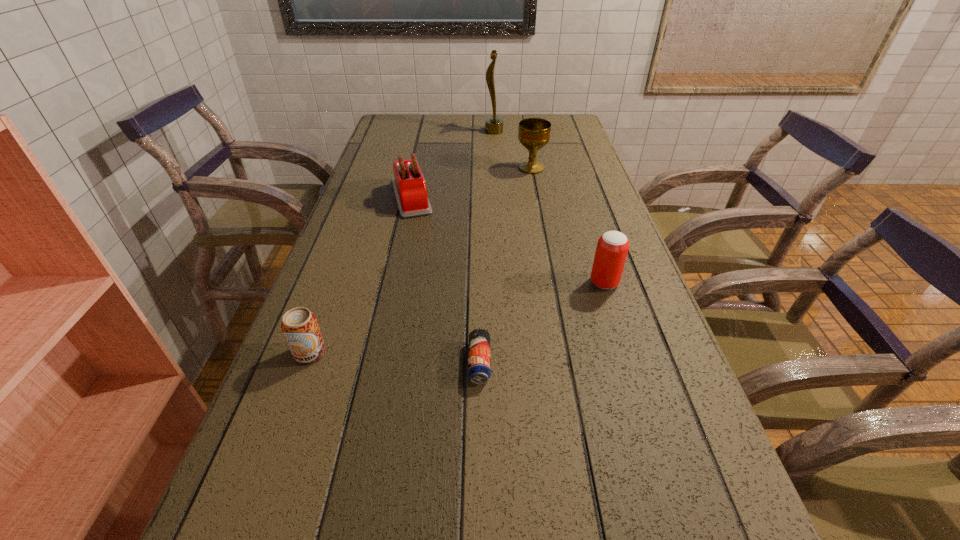
What are the coordinates of `object present at the far edge` in the screenshot? It's located at (494, 125).

I want to click on toaster positioned at the left edge, so click(x=409, y=185).

Identify the location of beer can that is at the left edge. The width and height of the screenshot is (960, 540). (300, 327).

You are a GUI agent. You are given a task and a screenshot of the screen. Output one action in this format:
    pyautogui.click(x=<x>, y=<y>)
    Task: Click on the object present at the right edge
    
    Given the screenshot: What is the action you would take?
    pyautogui.click(x=612, y=248)

This screenshot has height=540, width=960. I want to click on vacant position at the left edge of the desktop, so click(363, 343).

You are a GUI agent. You are given a task and a screenshot of the screen. Output one action in this format:
    pyautogui.click(x=<x>, y=<y>)
    Task: Click on the vacant area at the right edge
    The width and height of the screenshot is (960, 540).
    Given the screenshot: What is the action you would take?
    pyautogui.click(x=585, y=167)

In the image, there is a desktop. Identify the location of free space at the far left corner. The width and height of the screenshot is (960, 540). (402, 125).

At what (x,y) coordinates should I click in order to perform the action: click on vacant space at the far right corner of the desktop. Please return your answer as a coordinate pair (x, y). The height and width of the screenshot is (540, 960). Looking at the image, I should click on (541, 116).

This screenshot has height=540, width=960. I want to click on vacant space that's between the second tallest beer can and the third farthest object, so click(361, 275).

This screenshot has width=960, height=540. Identify the location of blank region between the farthest object and the tallest beer can. (549, 207).